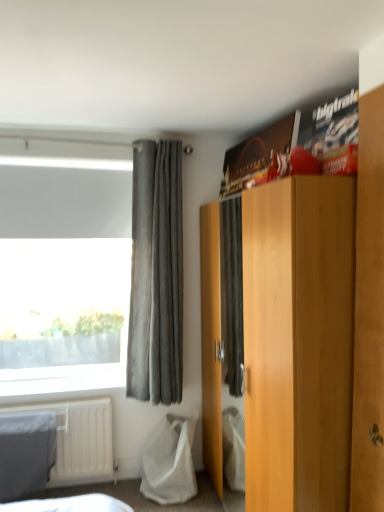
Question: In terms of width, does brown wooden wardrobe at upper right look wider or thinner when compared to gray suede curtain at left?

Choices:
 (A) wide
 (B) thin

Answer: (B)

Question: From a real-world perspective, is brown wooden wardrobe at upper right positioned above or below gray suede curtain at left?

Choices:
 (A) above
 (B) below

Answer: (B)

Question: Which object is positioned farthest from the gray cotton blanket at lower left?

Choices:
 (A) light brown wood cabinet at center
 (B) white mesh bag at lower left
 (C) gray suede curtain at left
 (D) brown wooden wardrobe at upper right

Answer: (D)

Question: Estimate the real-world distances between objects in this image. Which object is farther from the light brown wood cabinet at center?

Choices:
 (A) gray suede curtain at left
 (B) brown wooden wardrobe at upper right
 (C) gray cotton blanket at lower left
 (D) white mesh bag at lower left

Answer: (C)